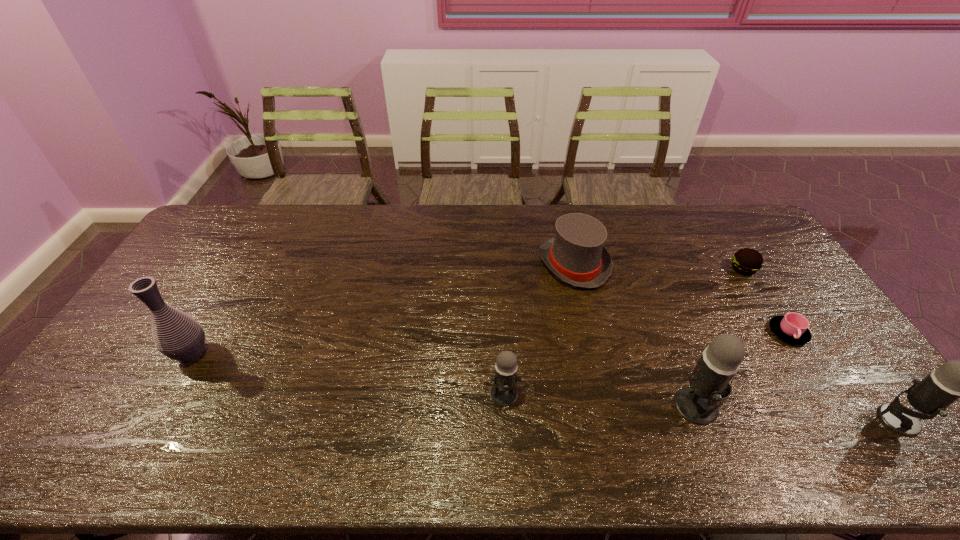
The image size is (960, 540). I want to click on vase, so click(x=177, y=335).

I want to click on vacant area situated 0.330m on the right of the sixth object from right to left, so click(646, 394).

Where is `free space located on the back of the tallest microphone`? free space located on the back of the tallest microphone is located at coordinates (672, 344).

The image size is (960, 540). What are the coordinates of `free region located 0.150m on the back of the rightmost microphone` in the screenshot? It's located at (850, 354).

Identify the location of vacant area located on the back of the third object from left to right. (566, 232).

Locate an element on the screen. The height and width of the screenshot is (540, 960). vacant space situated on the front of the patty is located at coordinates (767, 308).

Where is `vacant space positioned 0.080m on the side with the handle of the cup`? vacant space positioned 0.080m on the side with the handle of the cup is located at coordinates (813, 372).

This screenshot has height=540, width=960. I want to click on free space located 0.070m on the right of the vase, so click(236, 354).

Where is `object that is at the far edge`? object that is at the far edge is located at coordinates (576, 255).

The width and height of the screenshot is (960, 540). Find the location of `microphone situated at the right edge`. microphone situated at the right edge is located at coordinates (955, 379).